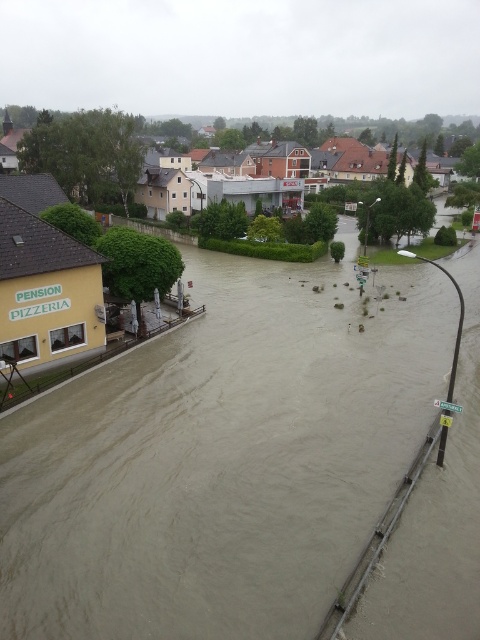
You are a rescue worker trying to reach the yellow building at left to evacuate people. The brown muddy water at lower center is in your path. Can you safely walk across the water to reach the building if the water depth is 1.5 meters?

The brown muddy water at lower center is 48.95 meters from the yellow building at left. Since the water depth is 1.5 meters, it is too deep for safe walking. You should use a boat or other watercraft to reach the yellow building at left.

You are a drone operator trying to capture the brown muddy water at lower center in the flooded area. According to the coordinates provided, where should you direct your drone to focus?

The brown muddy water at lower center is located at coordinates point [223,458], so you should direct the drone to focus there.